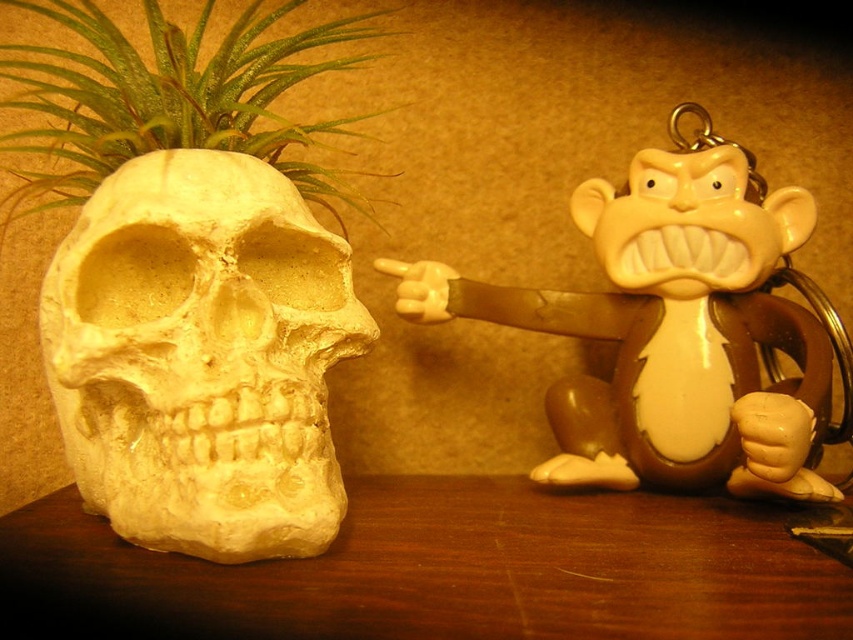
You are standing in front of a wooden table with two objects. You see a white matte skull at left and a brown monkey figurine at right. There is a point marked at coordinates (201, 356). Which object is located at that point?

The white matte skull at left is located at point (201, 356).

You are standing in front of the wooden table at lower center and want to reach the matte brown monkey at right. Which direction should you move to get closer to the monkey?

Since the wooden table at lower center is in front of the matte brown monkey at right, you should move backward to get closer to the matte brown monkey at right.

You are an interior designer arranging items on a shelf. You have a white matte skull at left and a green leafy plant at left. Which item takes up more space on the shelf?

The green leafy plant at left occupies more space than the white matte skull at left.